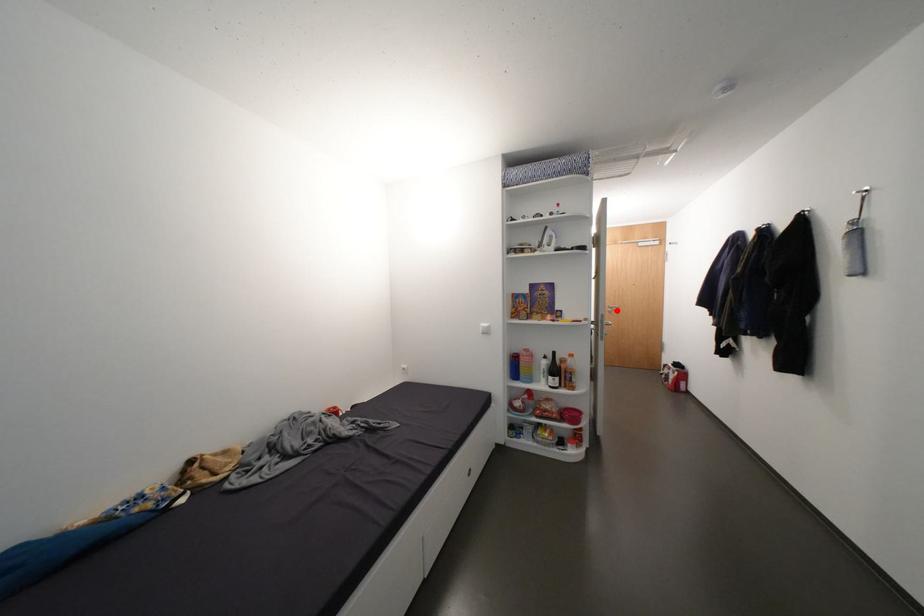
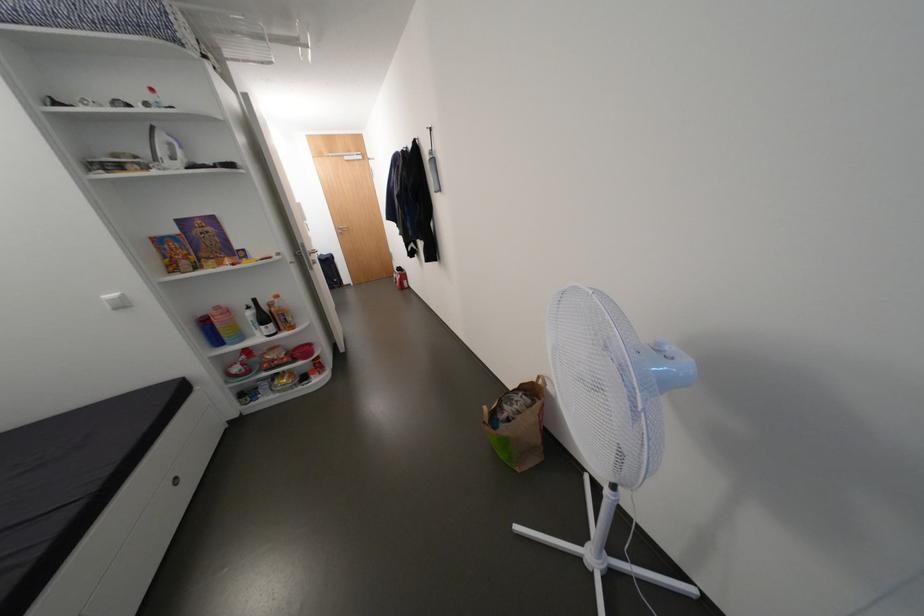
Question: I am providing you with two images of the same scene from different viewpoints. A red point is marked on the first image. Is the red point's position out of view in image 2?

Choices:
 (A) Yes
 (B) No

Answer: (B)